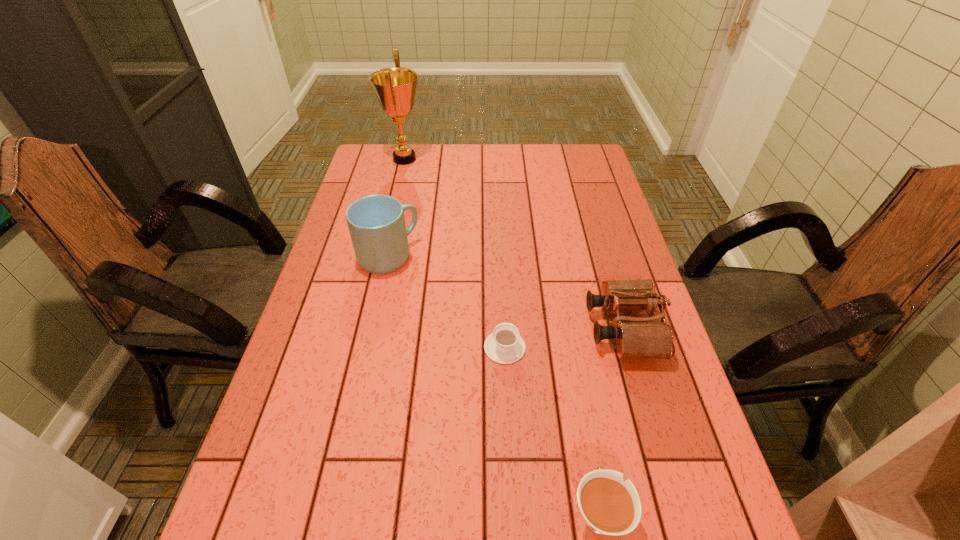
Select which object appears as the fourth closest to the award. Please provide its 2D coordinates. Your answer should be formatted as a tuple, i.e. [(x, y)], where the tuple contains the x and y coordinates of a point satisfying the conditions above.

[(612, 507)]

In order to click on object identified as the fourth closest to the farthest object in this screenshot , I will do `click(612, 507)`.

Find the location of a particular element. This screenshot has height=540, width=960. free location that satisfies the following two spatial constraints: 1. on the handle side of the left teacup; 2. on the front view with handles of the award is located at coordinates (495, 159).

Locate an element on the screen. The width and height of the screenshot is (960, 540). vacant space that satisfies the following two spatial constraints: 1. on the handle side of the shorter teacup; 2. on the front view with handles of the award is located at coordinates (495, 159).

Locate an element on the screen. The image size is (960, 540). free space that satisfies the following two spatial constraints: 1. on the front view with handles of the farthest object; 2. on the handle side of the shortest object is located at coordinates (360, 347).